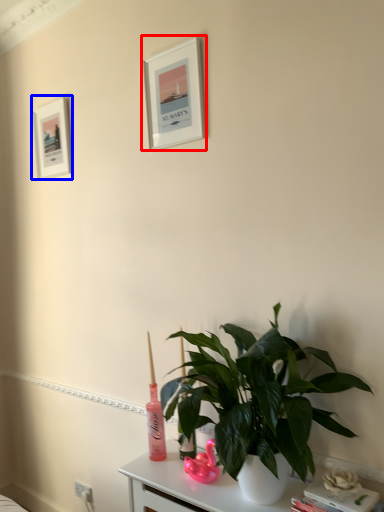
Question: Which object appears closest to the camera in this image, picture frame (highlighted by a red box) or picture frame (highlighted by a blue box)?

Choices:
 (A) picture frame
 (B) picture frame

Answer: (A)